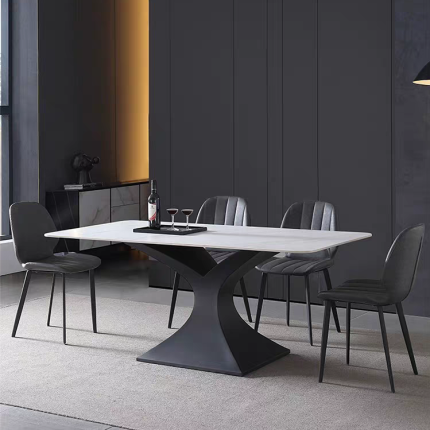
Image resolution: width=430 pixels, height=430 pixels. What are the coordinates of `rug` in the screenshot? It's located at (199, 403).